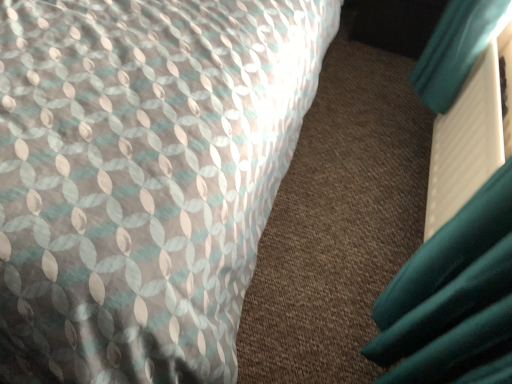
Measure the distance between textured fabric bed at upper left and camera.

textured fabric bed at upper left and camera are 24.28 inches apart.

What do you see at coordinates (144, 175) in the screenshot?
I see `textured fabric bed at upper left` at bounding box center [144, 175].

The height and width of the screenshot is (384, 512). I want to click on textured fabric bed at upper left, so click(x=144, y=175).

Measure the distance between point (436, 190) and camera.

Point (436, 190) is 4.20 feet away from camera.

Where is `teal matte book at right`? The height and width of the screenshot is (384, 512). teal matte book at right is located at coordinates (471, 135).

What do you see at coordinates (471, 135) in the screenshot? I see `teal matte book at right` at bounding box center [471, 135].

You are a GUI agent. You are given a task and a screenshot of the screen. Output one action in this format:
    pyautogui.click(x=<x>, y=<y>)
    Task: Click on the textured fabric bed at upper left
    This screenshot has width=512, height=384.
    Given the screenshot: What is the action you would take?
    pyautogui.click(x=144, y=175)

Considering the relative positions of textured fabric bed at upper left and teal matte book at right in the image provided, is textured fabric bed at upper left to the right of teal matte book at right from the viewer's perspective?

No.

Is textured fabric bed at upper left closer to camera compared to teal matte book at right?

Yes, textured fabric bed at upper left is in front of teal matte book at right.

Considering the positions of point (166, 215) and point (479, 72), is point (166, 215) closer or farther from the camera than point (479, 72)?

Point (166, 215) is closer to the camera than point (479, 72).

Based on the photo, from the image's perspective, is textured fabric bed at upper left located above or below teal matte book at right?

From the image's perspective, textured fabric bed at upper left appears above teal matte book at right.

From a real-world perspective, who is located lower, textured fabric bed at upper left or teal matte book at right?

In real-world perspective, teal matte book at right is lower.

In terms of width, does textured fabric bed at upper left look wider or thinner when compared to teal matte book at right?

textured fabric bed at upper left is wider than teal matte book at right.

In the scene shown: Considering the sizes of textured fabric bed at upper left and teal matte book at right in the image, is textured fabric bed at upper left taller or shorter than teal matte book at right?

Clearly, textured fabric bed at upper left is taller compared to teal matte book at right.

In terms of size, does textured fabric bed at upper left appear bigger or smaller than teal matte book at right?

textured fabric bed at upper left is bigger than teal matte book at right.

Is textured fabric bed at upper left spatially inside teal matte book at right, or outside of it?

textured fabric bed at upper left is not enclosed by teal matte book at right.

Is textured fabric bed at upper left placed right next to teal matte book at right?

textured fabric bed at upper left and teal matte book at right are clearly separated.

Is textured fabric bed at upper left looking in the opposite direction of teal matte book at right?

textured fabric bed at upper left does not have its back to teal matte book at right.

What's the angular difference between textured fabric bed at upper left and teal matte book at right's facing directions?

The facing directions of textured fabric bed at upper left and teal matte book at right are 89.6 degrees apart.

Where is `bed in front of the teal matte book at right`? The image size is (512, 384). bed in front of the teal matte book at right is located at coordinates (144, 175).

Does teal matte book at right appear on the left side of textured fabric bed at upper left?

No, teal matte book at right is not to the left of textured fabric bed at upper left.

Which object is further away from the camera taking this photo, teal matte book at right or textured fabric bed at upper left?

Positioned behind is teal matte book at right.

Is point (439, 202) behind point (40, 231)?

Yes, point (439, 202) is farther from viewer.

From the image's perspective, would you say teal matte book at right is shown under textured fabric bed at upper left?

Indeed, from the image's perspective, teal matte book at right is shown beneath textured fabric bed at upper left.

From a real-world perspective, which object stands above the other?

From a 3D spatial view, textured fabric bed at upper left is above.

Can you confirm if teal matte book at right is wider than textured fabric bed at upper left?

No, teal matte book at right is not wider than textured fabric bed at upper left.

Who is taller, teal matte book at right or textured fabric bed at upper left?

With more height is textured fabric bed at upper left.

Considering the sizes of objects teal matte book at right and textured fabric bed at upper left in the image provided, who is smaller, teal matte book at right or textured fabric bed at upper left?

teal matte book at right.

Can we say teal matte book at right lies outside textured fabric bed at upper left?

teal matte book at right is positioned outside textured fabric bed at upper left.

Is teal matte book at right next to textured fabric bed at upper left?

No, teal matte book at right is not touching textured fabric bed at upper left.

Is teal matte book at right facing away from textured fabric bed at upper left?

teal matte book at right does not have its back to textured fabric bed at upper left.

How many degrees apart are the facing directions of teal matte book at right and textured fabric bed at upper left?

The angle between the facing direction of teal matte book at right and the facing direction of textured fabric bed at upper left is 89.6 degrees.

Measure the distance from teal matte book at right to textured fabric bed at upper left.

A distance of 25.65 inches exists between teal matte book at right and textured fabric bed at upper left.

Where is `bed in front of the teal matte book at right`? The height and width of the screenshot is (384, 512). bed in front of the teal matte book at right is located at coordinates tap(144, 175).

Locate an element on the screen. Image resolution: width=512 pixels, height=384 pixels. bed that appears on the left of teal matte book at right is located at coordinates (144, 175).

You are a GUI agent. You are given a task and a screenshot of the screen. Output one action in this format:
    pyautogui.click(x=<x>, y=<y>)
    Task: Click on the paperback book located underneath the textured fabric bed at upper left (from a real-world perspective)
    
    Given the screenshot: What is the action you would take?
    click(471, 135)